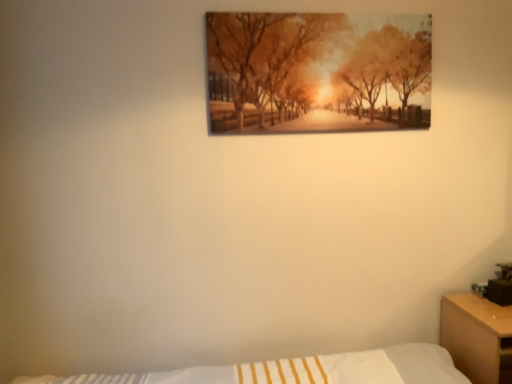
Question: From a real-world perspective, is wooden nightstand at right above or below matte wooden picture frame at upper center?

Choices:
 (A) above
 (B) below

Answer: (B)

Question: In terms of width, does wooden nightstand at right look wider or thinner when compared to matte wooden picture frame at upper center?

Choices:
 (A) thin
 (B) wide

Answer: (B)

Question: Which of these objects is positioned closest to the wooden nightstand at right?

Choices:
 (A) matte wooden picture frame at upper center
 (B) matte black table lamp at right

Answer: (B)

Question: Considering the real-world distances, which object is farthest from the matte black table lamp at right?

Choices:
 (A) matte wooden picture frame at upper center
 (B) wooden nightstand at right

Answer: (A)